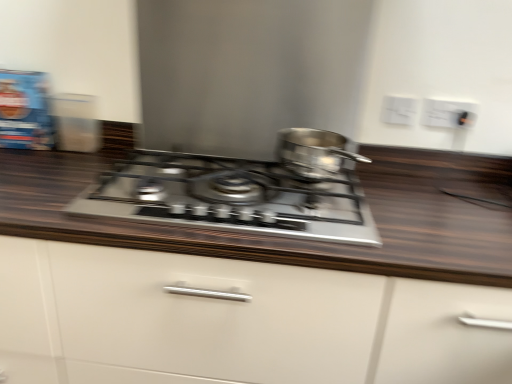
Question: Is satin silver gas stove at center bigger than white plastic electric outlet at upper right, arranged as the first electric outlet when viewed from the left?

Choices:
 (A) yes
 (B) no

Answer: (A)

Question: Is satin silver gas stove at center further to camera compared to white plastic electric outlet at upper right, arranged as the first electric outlet when viewed from the left?

Choices:
 (A) no
 (B) yes

Answer: (A)

Question: Is satin silver gas stove at center in contact with white plastic electric outlet at upper right, which is the 2th electric outlet in right-to-left order?

Choices:
 (A) no
 (B) yes

Answer: (A)

Question: From a real-world perspective, is satin silver gas stove at center on top of white plastic electric outlet at upper right, which is the 2th electric outlet in right-to-left order?

Choices:
 (A) yes
 (B) no

Answer: (B)

Question: Could you tell me if satin silver gas stove at center is facing white plastic electric outlet at upper right, arranged as the first electric outlet when viewed from the left?

Choices:
 (A) no
 (B) yes

Answer: (A)

Question: Is satin silver gas stove at center facing away from white plastic electric outlet at upper right, arranged as the first electric outlet when viewed from the left?

Choices:
 (A) yes
 (B) no

Answer: (B)

Question: From the image's perspective, is satin silver gas stove at center above white matte cabinet at center?

Choices:
 (A) no
 (B) yes

Answer: (B)

Question: Is satin silver gas stove at center to the right of white matte cabinet at center from the viewer's perspective?

Choices:
 (A) yes
 (B) no

Answer: (B)

Question: Is satin silver gas stove at center shorter than white matte cabinet at center?

Choices:
 (A) no
 (B) yes

Answer: (B)

Question: Is satin silver gas stove at center thinner than white matte cabinet at center?

Choices:
 (A) no
 (B) yes

Answer: (B)

Question: Is satin silver gas stove at center positioned with its back to white matte cabinet at center?

Choices:
 (A) no
 (B) yes

Answer: (B)

Question: Can you confirm if satin silver gas stove at center is bigger than white matte cabinet at center?

Choices:
 (A) yes
 (B) no

Answer: (B)

Question: Does white matte cabinet at center lie behind satin silver gas stove at center?

Choices:
 (A) yes
 (B) no

Answer: (B)